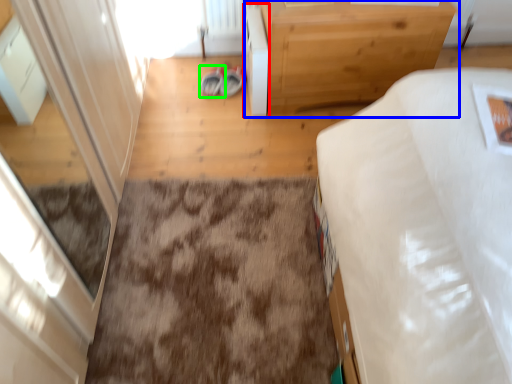
Question: Which is nearer to the cabinetry (highlighted by a red box)? table (highlighted by a blue box) or footwear (highlighted by a green box).

Choices:
 (A) table
 (B) footwear

Answer: (A)